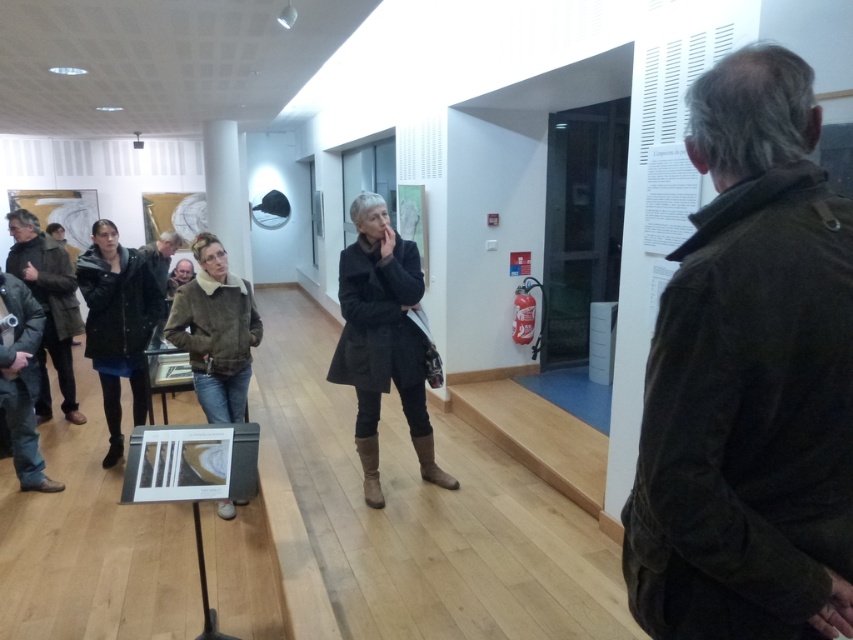
Where is the brown suede jacket at center located in the image?

The brown suede jacket at center is located at point coordinates of (215, 332).

You are a tour guide leading a group in an art gallery. You notice two visitors wearing a dark gray wool coat at center and a dark brown leather jacket at left. If you want to move between them to address the group, is there enough space for you to walk through comfortably? Please consider the distance between them and your own body width.

The distance between the dark gray wool coat at center and the dark brown leather jacket at left is 2.42 meters. Assuming an average body width of about 0.5 meters, there is sufficient space for you to walk through comfortably between them.

You are an art gallery attendant and need to determine the correct size of coats to offer visitors. Given the dark gray wool coat at center and the dark brown leather jacket at left, which coat is smaller?

The dark gray wool coat at center is smaller compared to the dark brown leather jacket at left.